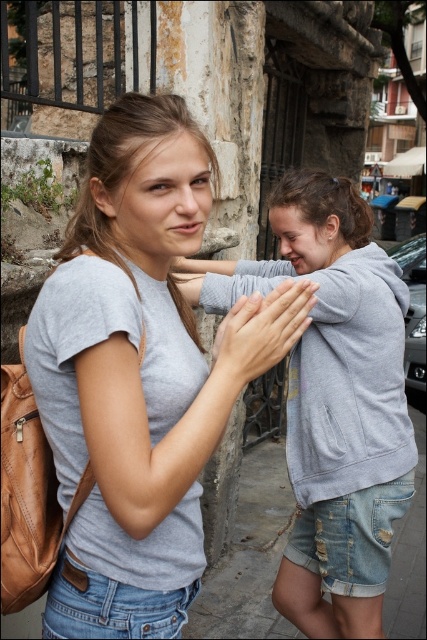
Does point (298, 456) come in front of point (233, 332)?

That is False.

Can you confirm if matte gray hoodie at center is bigger than matte gray hand at center?

Yes.

Which is in front, point (216, 308) or point (298, 305)?

Point (298, 305)

The height and width of the screenshot is (640, 427). What are the coordinates of `matte gray hoodie at center` in the screenshot? It's located at (333, 401).

Does gray matte t-shirt at center have a lesser width compared to matte gray hand at center?

No.

Is gray matte t-shirt at center above matte gray hand at center?

No.

Who is more forward, (x=94, y=205) or (x=280, y=300)?

Point (x=280, y=300)

Locate an element on the screen. The height and width of the screenshot is (640, 427). gray matte t-shirt at center is located at coordinates (140, 374).

Can you confirm if gray matte t-shirt at center is positioned above matte gray hoodie at center?

Yes.

Is point (90, 196) closer to camera compared to point (289, 609)?

Yes, point (90, 196) is closer to viewer.

This screenshot has width=427, height=640. Identify the location of gray matte t-shirt at center. (140, 374).